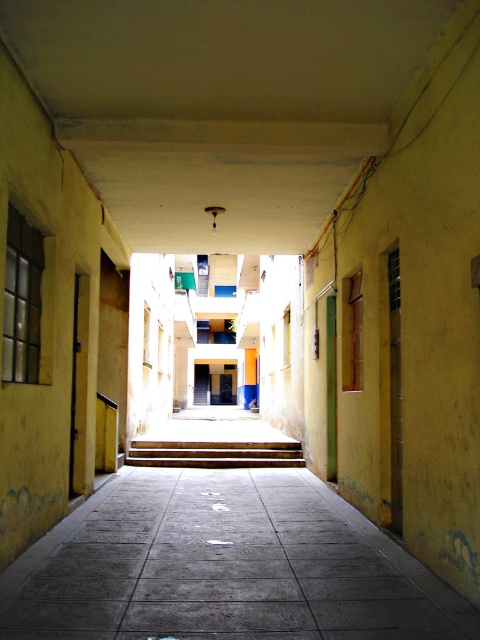
You are a delivery person carrying a large package and need to move through the corridor. You see the gray concrete pavement at center and the wooden stairs at center. Which surface should you choose to ensure stability for your delivery?

The wooden stairs at center are larger than the gray concrete pavement at center, so the wooden stairs at center provide a more stable surface for carrying a large package.

You are a delivery person carrying a heavy box and need to move from the entrance of the corridor to the door on the left. The gray concrete pavement at center and wooden stairs at center are in your path. Which object should you avoid stepping on to ensure your box doesn

The gray concrete pavement at center is located above wooden stairs at center. To avoid tripping, you should avoid stepping on the wooden stairs at center and stay on the gray concrete pavement at center with a stable surface.